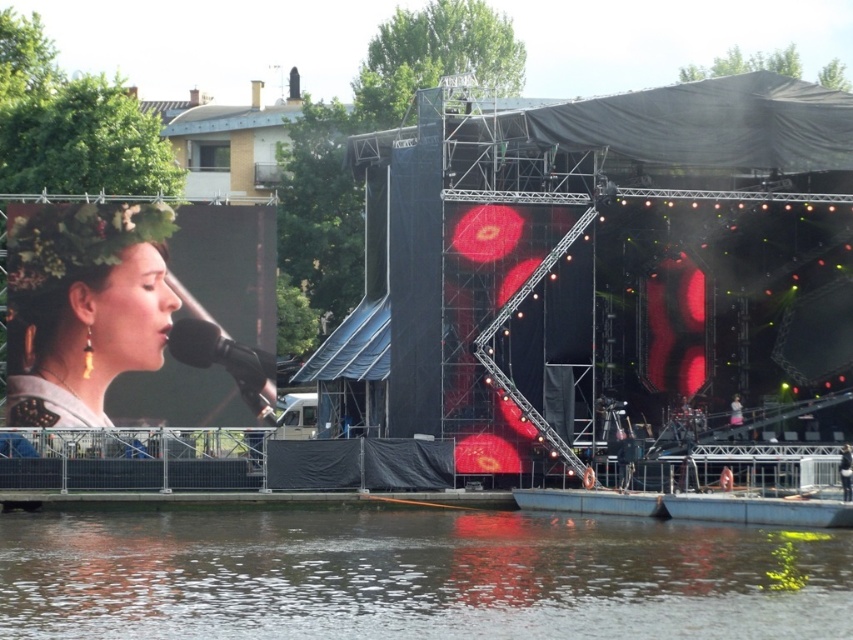
Question: Based on their relative distances, which object is farther from the matte floral crown at left?

Choices:
 (A) black matte microphone at center
 (B) smooth water at lower center

Answer: (B)

Question: Does smooth water at lower center come in front of matte floral crown at left?

Choices:
 (A) no
 (B) yes

Answer: (B)

Question: Does matte floral crown at left appear on the right side of black matte microphone at center?

Choices:
 (A) yes
 (B) no

Answer: (B)

Question: Which point is closer to the camera taking this photo?

Choices:
 (A) (6, 538)
 (B) (201, 358)

Answer: (A)

Question: Which object is farther from the camera taking this photo?

Choices:
 (A) black matte microphone at center
 (B) smooth water at lower center

Answer: (A)

Question: Does smooth water at lower center have a larger size compared to matte floral crown at left?

Choices:
 (A) yes
 (B) no

Answer: (A)